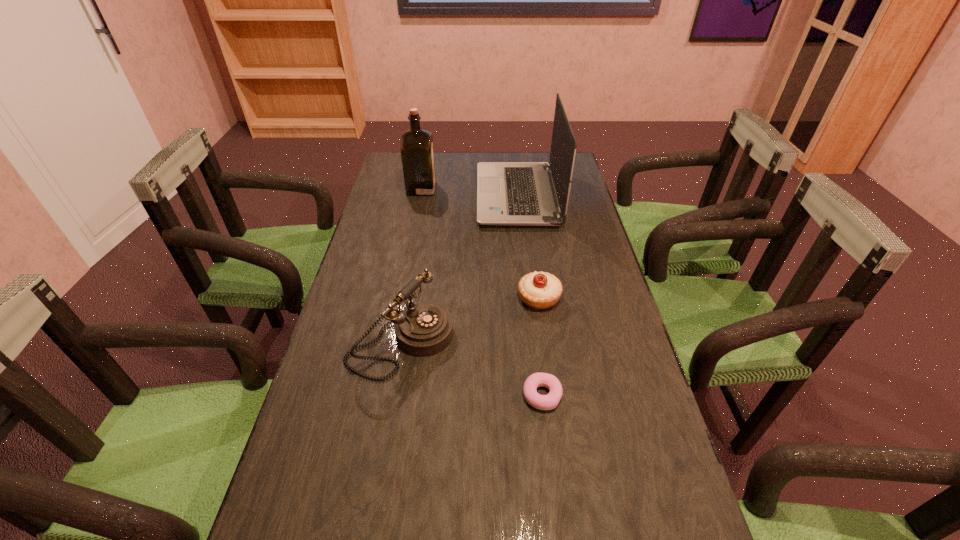
Locate an element on the screen. free space located 0.150m on the label of the liquor is located at coordinates (475, 188).

Identify the location of vacant space located 0.110m on the right of the third tallest object. The image size is (960, 540). (496, 342).

Identify the location of vacant space located 0.100m on the left of the fourth tallest object. This screenshot has width=960, height=540. (482, 298).

Find the location of a particular element. The width and height of the screenshot is (960, 540). blank space located on the left of the shorter pastry is located at coordinates (452, 395).

The width and height of the screenshot is (960, 540). Find the location of `laptop computer at the far edge`. laptop computer at the far edge is located at coordinates (508, 193).

Find the location of a particular element. The width and height of the screenshot is (960, 540). liquor that is at the far edge is located at coordinates (417, 153).

The height and width of the screenshot is (540, 960). I want to click on liquor present at the left edge, so click(x=417, y=153).

Where is `telephone at the left edge`? This screenshot has height=540, width=960. telephone at the left edge is located at coordinates (425, 329).

Identify the location of laptop computer situated at the right edge. This screenshot has height=540, width=960. (508, 193).

Locate an element on the screen. This screenshot has height=540, width=960. pastry that is positioned at the right edge is located at coordinates (539, 290).